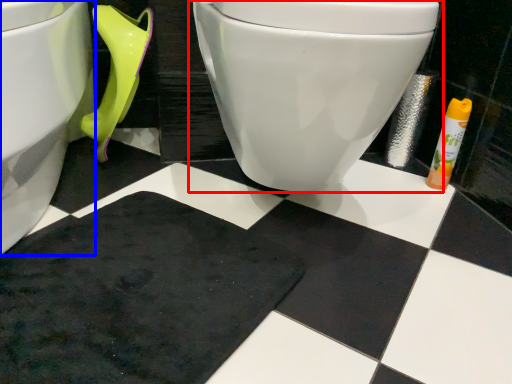
Question: Which object appears closest to the camera in this image, toilet (highlighted by a red box) or toilet (highlighted by a blue box)?

Choices:
 (A) toilet
 (B) toilet

Answer: (B)